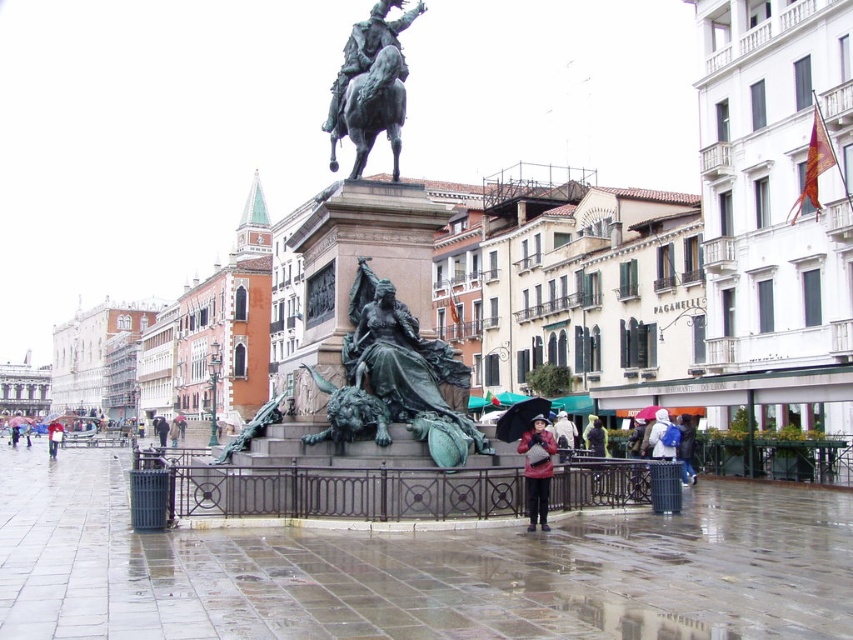
Question: Is matte red coat at lower center smaller than black matte umbrella at lower center?

Choices:
 (A) yes
 (B) no

Answer: (A)

Question: Which object is positioned closest to the matte red coat at lower center?

Choices:
 (A) black matte umbrella at center
 (B) bronze statue at center
 (C) white fabric umbrella at center
 (D) green patinated bronze statue at center

Answer: (D)

Question: Among these points, which one is nearest to the camera?

Choices:
 (A) (26, 422)
 (B) (366, 64)
 (C) (692, 420)
 (D) (538, 412)

Answer: (D)

Question: Which point is farther from the camera taking this photo?

Choices:
 (A) (693, 440)
 (B) (653, 404)
 (C) (454, 422)
 (D) (27, 429)

Answer: (D)

Question: Is green patinated bronze statue at center thinner than bronze statue at center?

Choices:
 (A) yes
 (B) no

Answer: (B)

Question: Is black matte umbrella at lower center above black matte umbrella at center?

Choices:
 (A) yes
 (B) no

Answer: (A)